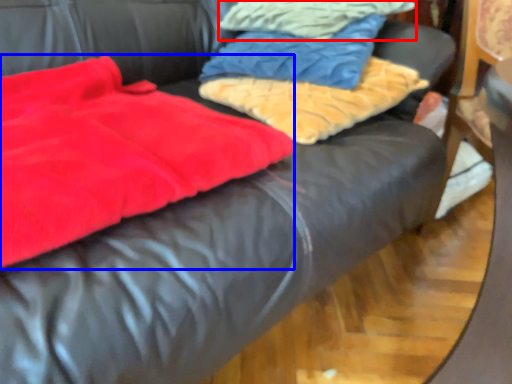
Question: Among these objects, which one is farthest to the camera, cloth (highlighted by a red box) or blanket (highlighted by a blue box)?

Choices:
 (A) cloth
 (B) blanket

Answer: (A)